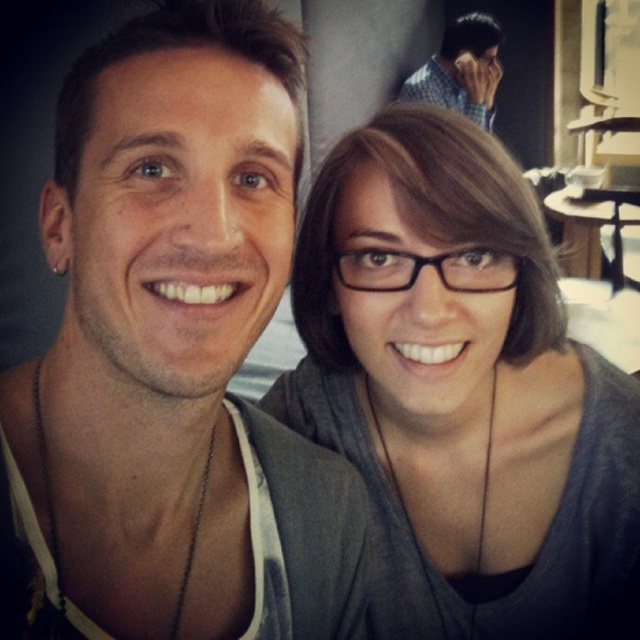
From the picture: Does gray matte shirt at center appear over checkered shirt at upper right?

No.

Which is in front, point (371, 346) or point (493, 93)?

Point (371, 346)

Locate an element on the screen. The width and height of the screenshot is (640, 640). gray matte shirt at center is located at coordinates (464, 396).

Is matte black shirt at center shorter than gray matte shirt at center?

Correct, matte black shirt at center is not as tall as gray matte shirt at center.

Based on the photo, is matte black shirt at center above gray matte shirt at center?

Yes.

Who is more forward, (58, 508) or (472, 124)?

Positioned in front is point (58, 508).

This screenshot has width=640, height=640. Identify the location of matte black shirt at center. (172, 356).

Measure the distance between point (152, 54) and camera.

A distance of 16.19 inches exists between point (152, 54) and camera.

Is matte black shirt at center positioned behind checkered shirt at upper right?

That is False.

Who is more forward, (3, 582) or (483, 125)?

Point (3, 582)

Identify the location of matte black shirt at center. The height and width of the screenshot is (640, 640). (172, 356).